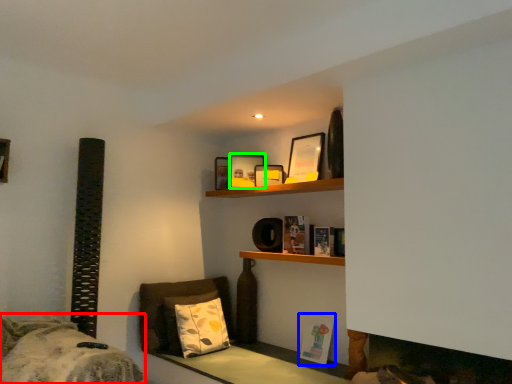
Question: Estimate the real-world distances between objects in this image. Which object is closer to bed (highlighted by a red box), book (highlighted by a blue box) or picture frame (highlighted by a green box)?

Choices:
 (A) book
 (B) picture frame

Answer: (A)